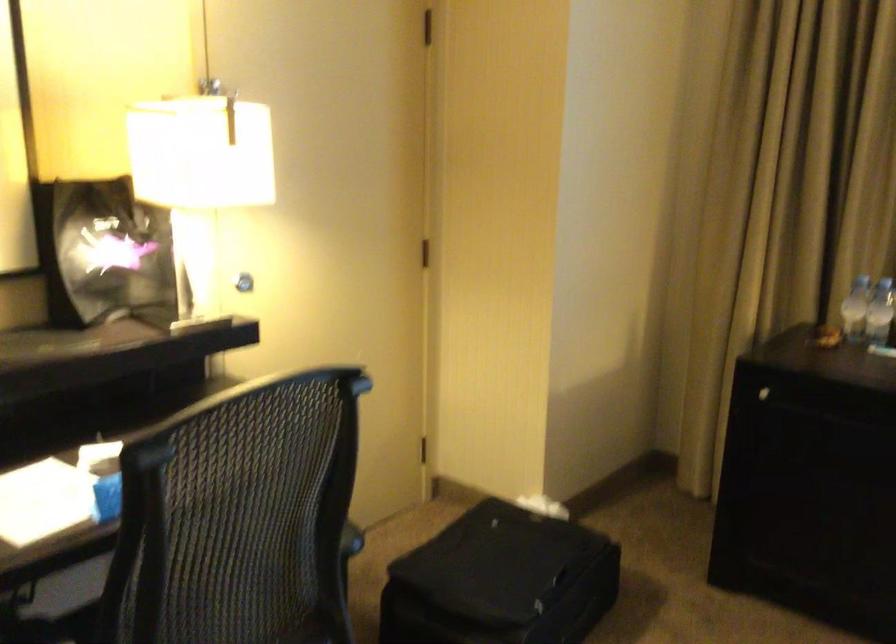
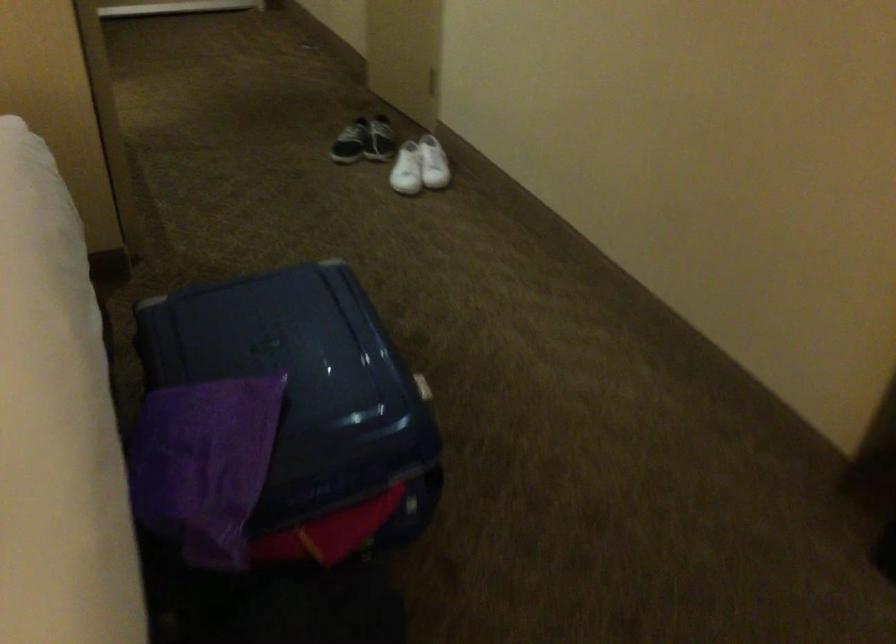
The images are taken continuously from a first-person perspective. In which direction is your viewpoint rotating?

The camera rotated toward left-down.